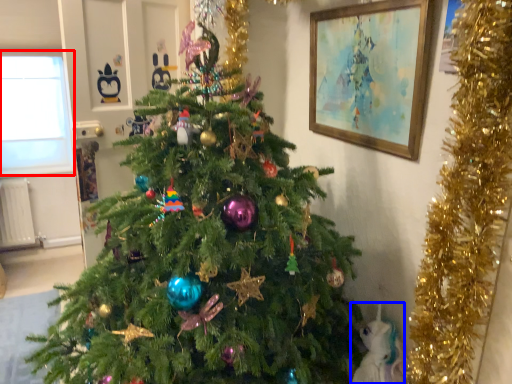
Question: Which point is closer to the camera, window screen (highlighted by a red box) or animal (highlighted by a blue box)?

Choices:
 (A) window screen
 (B) animal

Answer: (B)